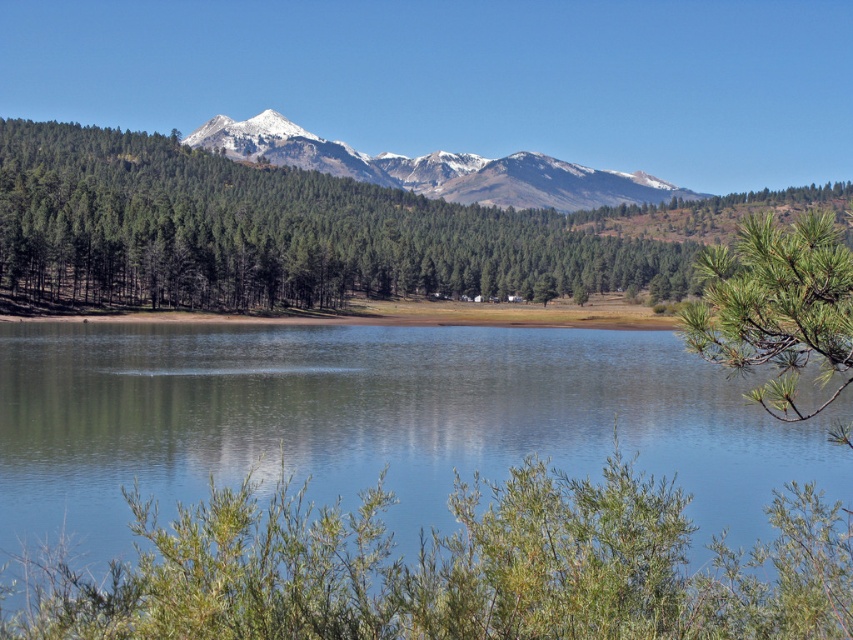
Question: Which of the following is the closest to the observer?

Choices:
 (A) green matte tree at center
 (B) snowy rocky mountains at center
 (C) green needle-like leaves at right
 (D) clear blue water at center

Answer: (C)

Question: Can you confirm if clear blue water at center is positioned to the right of snowy rocky mountains at center?

Choices:
 (A) yes
 (B) no

Answer: (B)

Question: Can you confirm if green matte tree at center is smaller than snowy rocky mountains at center?

Choices:
 (A) yes
 (B) no

Answer: (B)

Question: Considering the real-world distances, which object is farthest from the snowy rocky mountains at center?

Choices:
 (A) clear blue water at center
 (B) green needle-like leaves at right
 (C) green matte tree at center

Answer: (B)

Question: Considering the real-world distances, which object is farthest from the snowy rocky mountains at center?

Choices:
 (A) green needle-like leaves at right
 (B) green matte tree at center
 (C) clear blue water at center

Answer: (A)

Question: Can you confirm if green needle-like leaves at right is smaller than snowy rocky mountains at center?

Choices:
 (A) no
 (B) yes

Answer: (B)